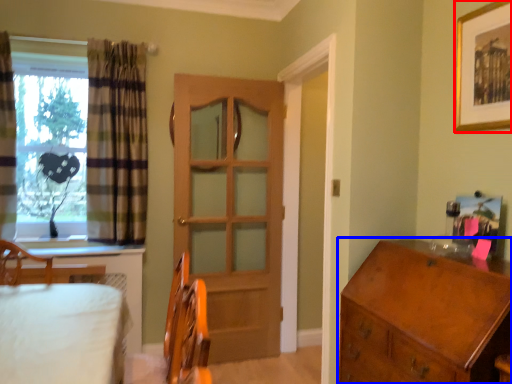
Question: Among these objects, which one is farthest to the camera, picture frame (highlighted by a red box) or chest of drawers (highlighted by a blue box)?

Choices:
 (A) picture frame
 (B) chest of drawers

Answer: (A)